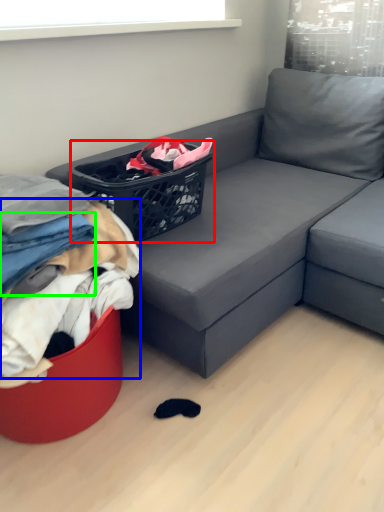
Question: Which object is positioned closest to basket (highlighted by a red box)? Select from clothing (highlighted by a blue box) and clothing (highlighted by a green box).

Choices:
 (A) clothing
 (B) clothing

Answer: (A)